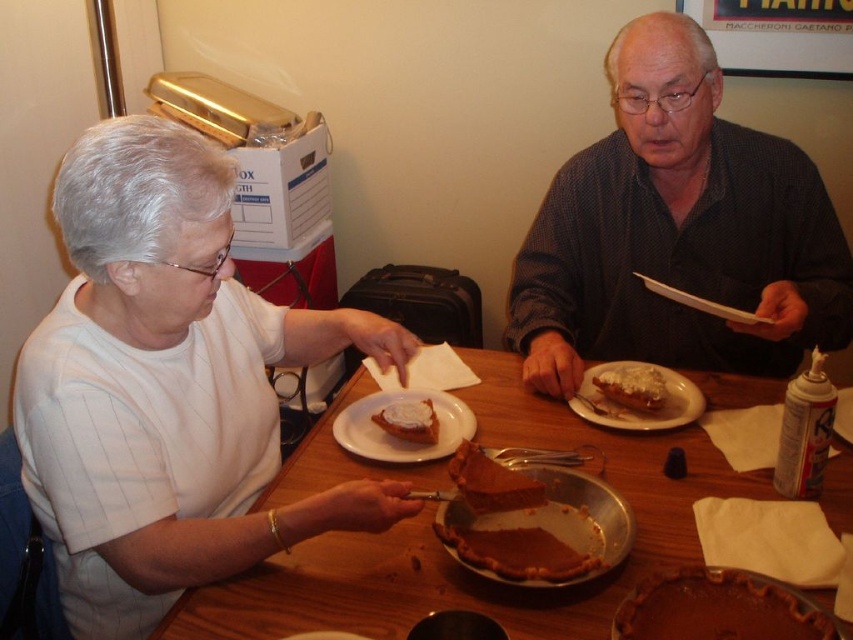
You are a photographer standing at the edge of the table, and you want to take a closeup of the pie. There are two points on the table marked as point 1 at coordinate (569, 541) and point 2 at coordinate (612, 403). Which point should you focus on to get the pie in focus?

Point 1 at coordinate (569, 541) is closer to the camera than point 2 at coordinate (612, 403), so focusing on point 1 will ensure the pie is in focus.

You are a guest at this table and want to place your bread on the plate. Can you move the slightly browned crusty bread at upper right directly onto the white matte plate at center without moving any other items?

The white matte plate at center is in front of the slightly browned crusty bread at upper right, so you can move the slightly browned crusty bread at upper right directly onto the white matte plate at center without moving other items since they are positioned in a straight line and the plate is accessible.

You are standing in front of the table and want to place a napkin on the table. You have two points to choose from. The first point is at coordinate point(229, 516) and the second is at point(691, 445). Which point is closer to you?

Point(229, 516) is closer to the viewer than point(691, 445), so you should place the napkin there.